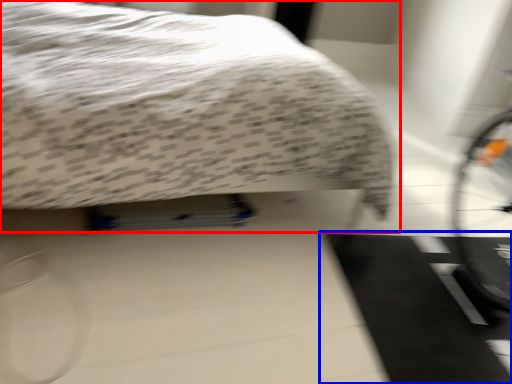
Question: Which of the following is the farthest to the observer, bed (highlighted by a red box) or doormat (highlighted by a blue box)?

Choices:
 (A) bed
 (B) doormat

Answer: (B)